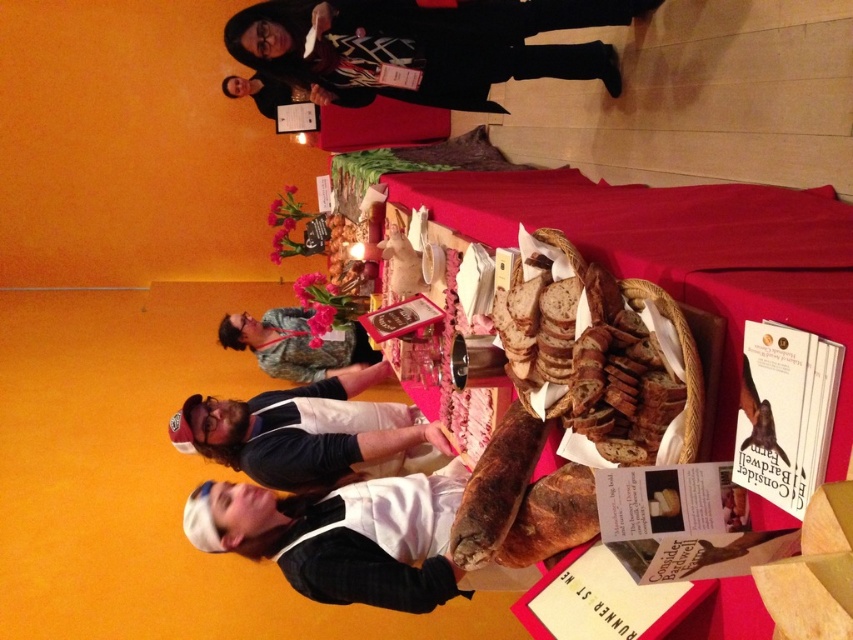
Question: Does matte brown bread basket at center appear under white fabric apron at lower center?

Choices:
 (A) no
 (B) yes

Answer: (A)

Question: Observing the image, what is the correct spatial positioning of white fabric apron at lower center in reference to camouflage fabric shirt at center?

Choices:
 (A) below
 (B) above

Answer: (A)

Question: Which is farther from the white fabric apron at lower center?

Choices:
 (A) matte brown bread basket at center
 (B) camouflage fabric shirt at center
 (C) brown matte bread at center

Answer: (C)

Question: Is the position of black wool coat at upper center more distant than that of camouflage fabric shirt at center?

Choices:
 (A) yes
 (B) no

Answer: (B)

Question: Estimate the real-world distances between objects in this image. Which object is closer to the white fabric apron at lower center?

Choices:
 (A) matte brown bread basket at center
 (B) brown matte bread at center
 (C) black wool coat at upper center
 (D) camouflage fabric shirt at center

Answer: (D)

Question: Among these points, which one is farthest from the camera?

Choices:
 (A) (421, 442)
 (B) (619, 205)
 (C) (254, 323)
 (D) (331, 92)

Answer: (C)